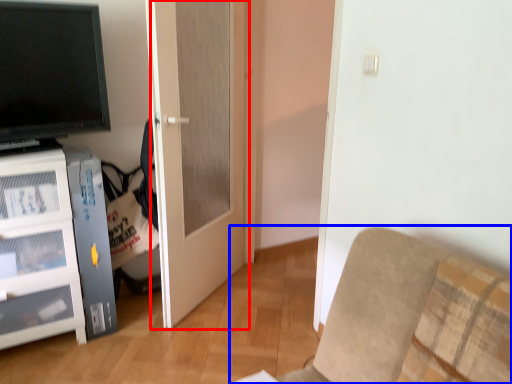
Question: Which object is closer to the camera taking this photo, door (highlighted by a red box) or furniture (highlighted by a blue box)?

Choices:
 (A) door
 (B) furniture

Answer: (B)